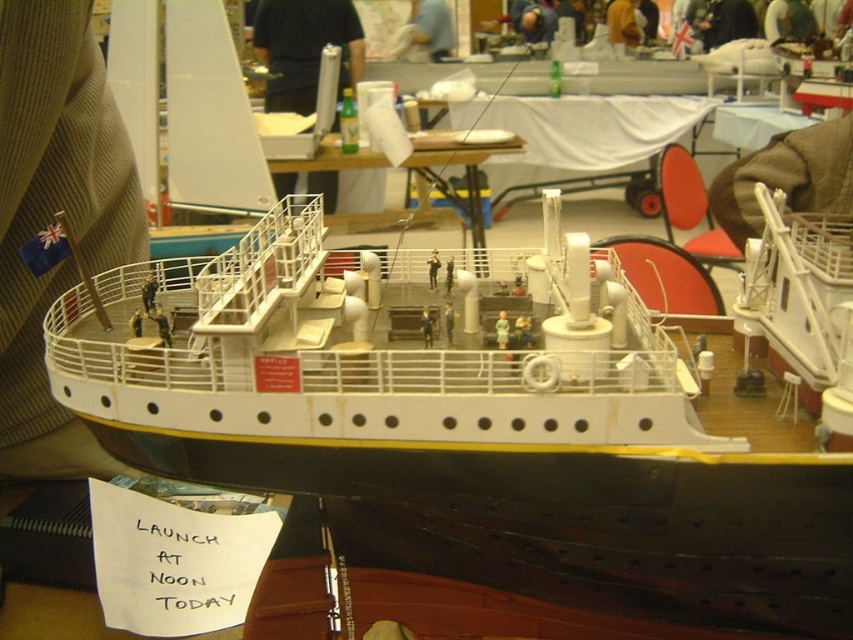
You are a visitor at the exhibition and want to take a photo of the white plastic ship at center with the red sign on the deck in the background. The camera you have can only focus on objects within 1 meter of each other. Will you be able to take this photo?

The white plastic ship at center and the red sign on the deck are 92.69 centimeters apart, which is within the 1 meter focus range. Yes, you can take the photo.

You are at an exhibition and want to take a photo of both the white plastic ship at center and the white fabric table at center. Which object should you position to your left side to include both in the frame?

To include both the white plastic ship at center and the white fabric table at center in the frame, position the white plastic ship at center to your left side since it is located to the left of the white fabric table at center.

You are an event organizer who needs to transport the white plastic ship at center and the white plastic table at center to a new location. The truck you have can only carry items that are narrower than 2 meters. Based on the scene, can both items fit in the truck?

The white plastic ship at center is wider than the white plastic table at center. Since the truck can only carry items narrower than 2 meters, we need to know the exact width of the ship. However, the description only states that the ship is wider than the table, but does not provide specific measurements. Therefore, it is uncertain if both items will fit in the truck without additional information about their actual widths.